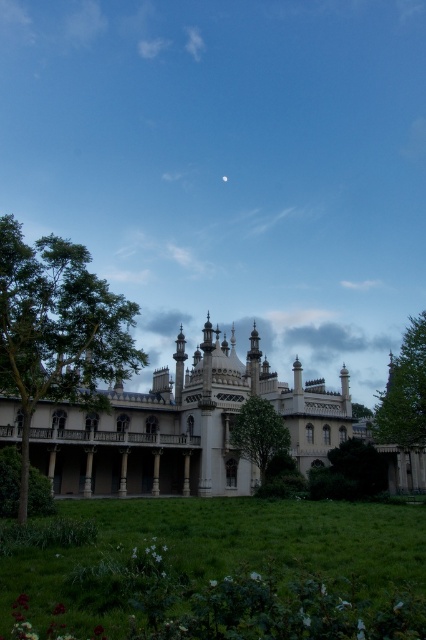
You are standing in front of the grand historic building and want to take a photo that includes both the green leafy tree at left and the green leafy tree at right. Which tree should you position closer to the building to ensure both are in the frame?

The green leafy tree at left is closer to the viewer than the green leafy tree at right, so to include both in the frame, position the green leafy tree at left closer to the building since it is already nearer to you.

Based on the photo, you are a landscape architect designing a walking path between the white stone palace at center and the green leafy tree at lower center. What is the minimum distance the path must cover to connect these two points?

The white stone palace at center and the green leafy tree at lower center are 21.66 meters apart from each other, so the path must be at least 21.66 meters long to connect them.

You are a landscape architect designing a walking path between the green leafy tree at left and the green leafy tree at right. What is the minimum width required for the path to ensure it can accommodate a 55 meter long decorative fountain?

The green leafy tree at left and green leafy tree at right are 57.26 meters apart, so the minimum width required for the path is 57.26 meters to accommodate the 55 meter long fountain with some space.